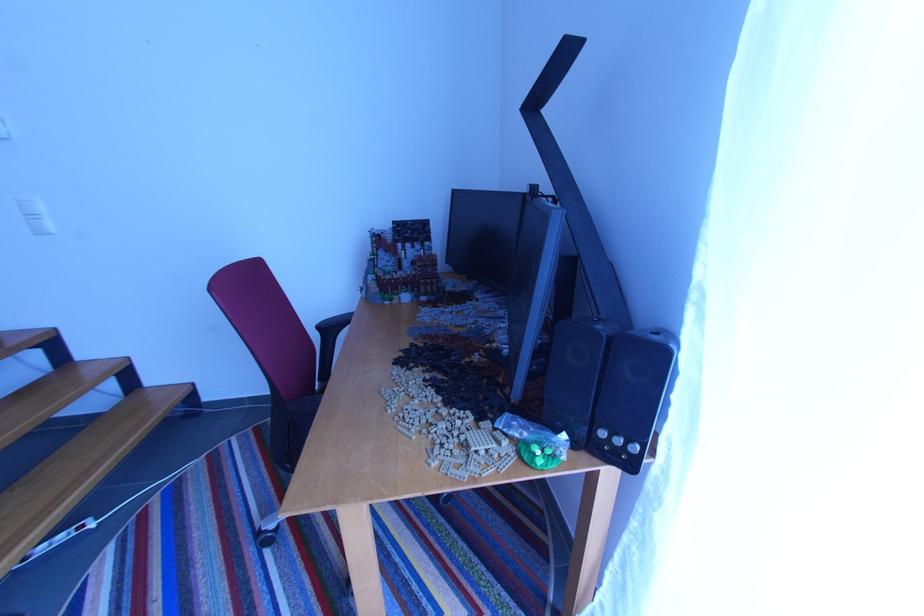
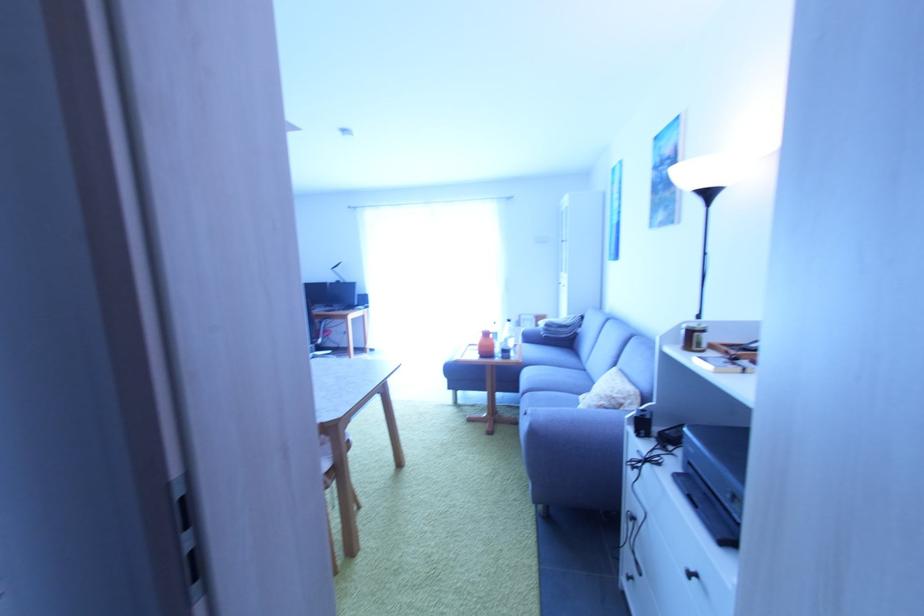
Question: I am providing you with two images of the same scene from different viewpoints. Please identify which objects are invisible in image2.

Choices:
 (A) black drawer handle
 (B) tan lego piece
 (C) sofa armrest
 (D) grey duct tape

Answer: (B)